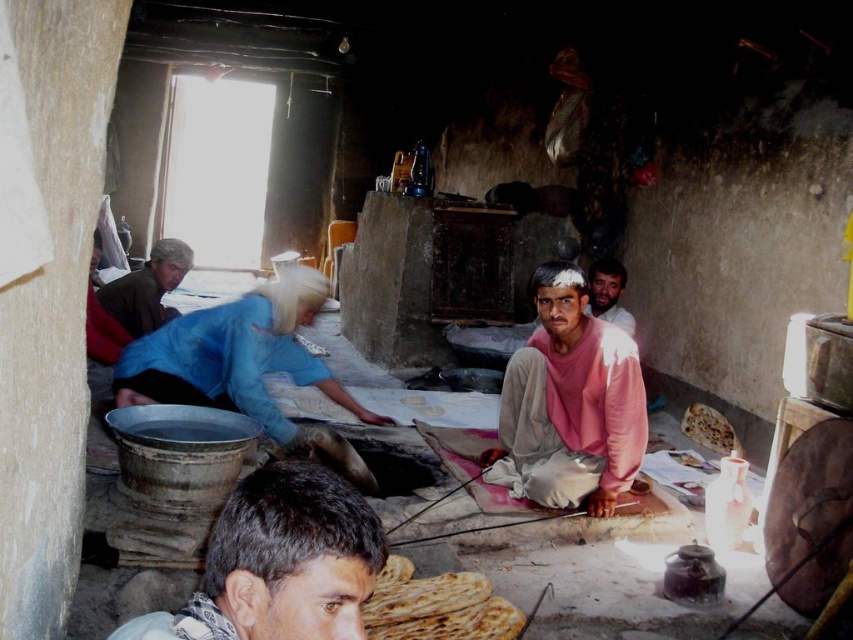
Question: Among these objects, which one is nearest to the camera?

Choices:
 (A) pink matte sweater at center
 (B) blue fabric at left

Answer: (A)

Question: Can you confirm if dark brown hair at lower center is positioned to the left of light pink fabric at center?

Choices:
 (A) yes
 (B) no

Answer: (A)

Question: Does dark brown hair at lower center lie behind blue fabric at left?

Choices:
 (A) yes
 (B) no

Answer: (B)

Question: Which object is the farthest from the light pink fabric at center?

Choices:
 (A) pink matte sweater at center
 (B) blue fabric at left

Answer: (B)

Question: Is pink matte sweater at center further to camera compared to blue fabric at left?

Choices:
 (A) no
 (B) yes

Answer: (A)

Question: Among these points, which one is farthest from the camera?

Choices:
 (A) (148, 636)
 (B) (602, 278)
 (C) (180, 280)
 (D) (585, 296)

Answer: (B)